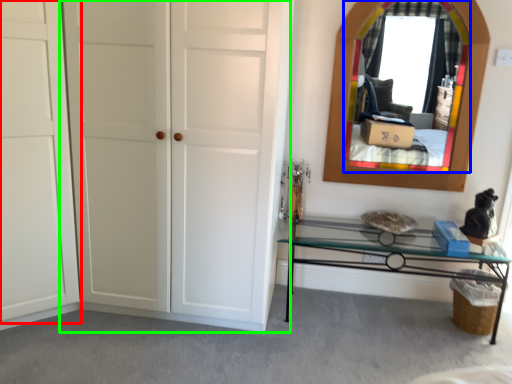
Question: Estimate the real-world distances between objects in this image. Which object is farther from door (highlighted by a red box), mirror (highlighted by a blue box) or door (highlighted by a green box)?

Choices:
 (A) mirror
 (B) door

Answer: (A)